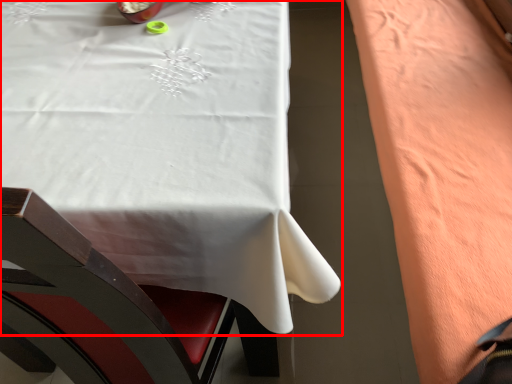
Question: Observing the image, what is the correct spatial positioning of table (annotated by the red box) in reference to blanket?

Choices:
 (A) right
 (B) left

Answer: (B)